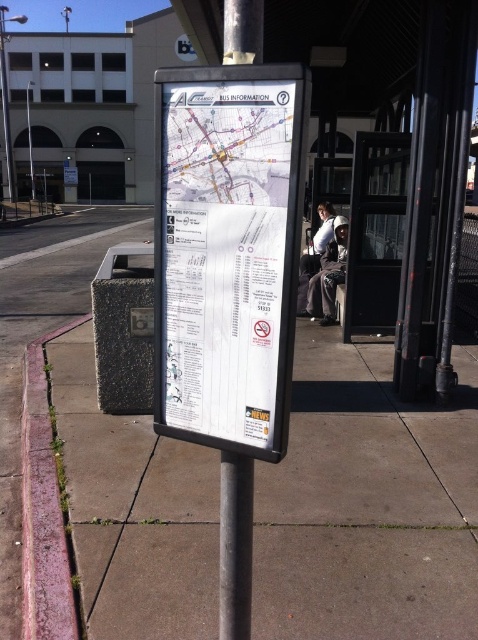
You are a pedestrian standing at the bus stop. You need to locate the bus information sign. According to the scene, where is the metallic gray pole at center relative to the concrete sidewalk at center?

The metallic gray pole at center is behind the concrete sidewalk at center, so the bus information sign is likely mounted on the pole behind the sidewalk.

You are a delivery person carrying a large box that requires placing on a surface. You see the concrete sidewalk at center and the metallic gray pole at center. Which surface can you place the box on?

The concrete sidewalk at center is bigger than the metallic gray pole at center, so the box can be placed on the concrete sidewalk at center.